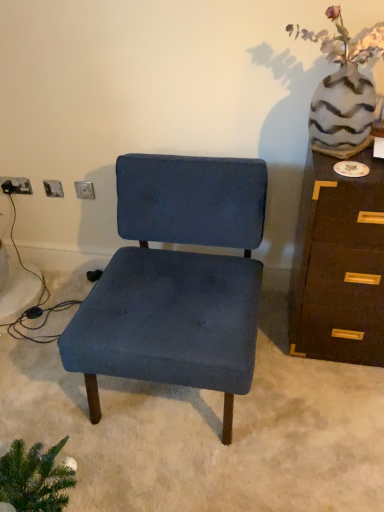
This screenshot has height=512, width=384. What are the coordinates of `vacant area that is situated to the right of velvet blue chair at center` in the screenshot? It's located at (307, 390).